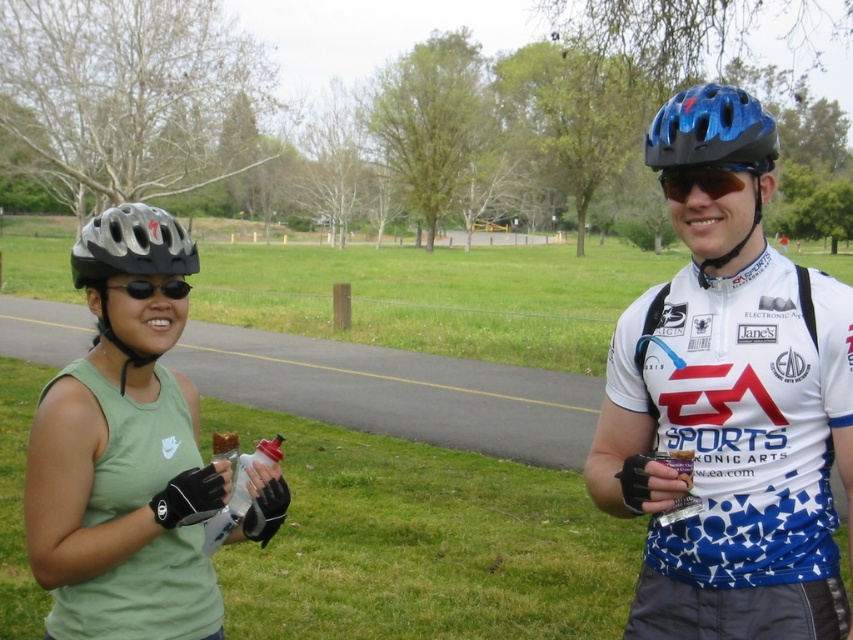
Question: Which object appears farthest from the camera in this image?

Choices:
 (A) black matte sunglasses at left
 (B) white jersey at center
 (C) blue matte helmet at upper right
 (D) blue matte helmet at upper center

Answer: (A)

Question: Among these objects, which one is nearest to the camera?

Choices:
 (A) matte black helmet at left
 (B) white jersey at center
 (C) silver/metallic helmet at left

Answer: (B)

Question: Is matte black helmet at left closer to the viewer compared to silver/metallic helmet at left?

Choices:
 (A) no
 (B) yes

Answer: (B)

Question: Can you confirm if green matte helmet at left is smaller than matte black helmet at left?

Choices:
 (A) no
 (B) yes

Answer: (B)

Question: Can you confirm if green matte helmet at left is positioned to the right of black matte sunglasses at left?

Choices:
 (A) no
 (B) yes

Answer: (A)

Question: Which object appears farthest from the camera in this image?

Choices:
 (A) blue matte helmet at upper right
 (B) black matte sunglasses at left
 (C) sunglasses at center

Answer: (B)